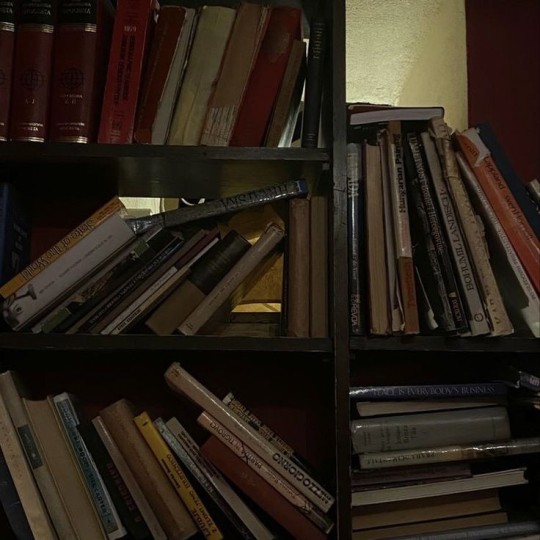
Find the location of a particular element. books laying on other books is located at coordinates (235, 207), (398, 396), (373, 413), (389, 430), (402, 453), (410, 465), (417, 484), (438, 507), (452, 521), (429, 111).